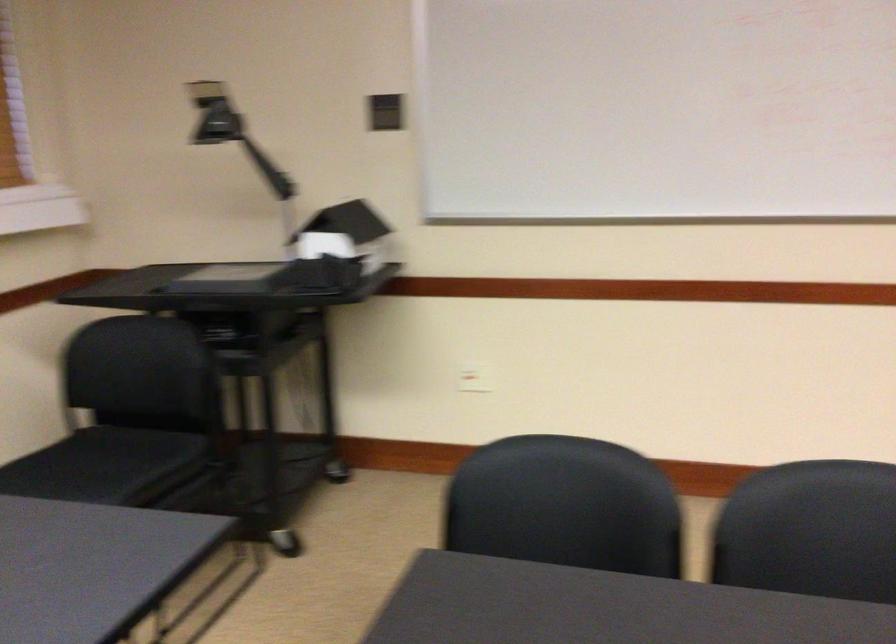
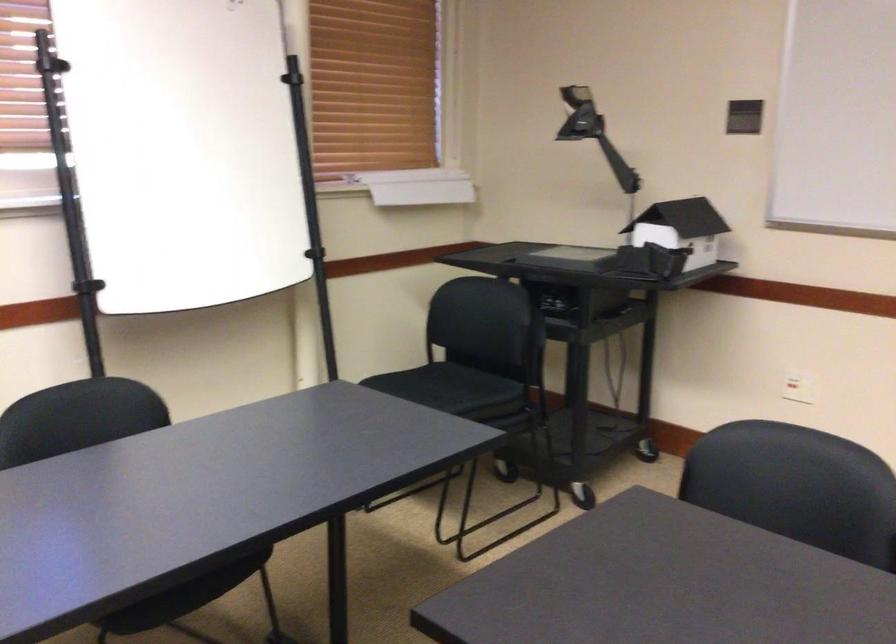
In the second image, find the point that corresponds to point 117,446 in the first image.

(449, 383)